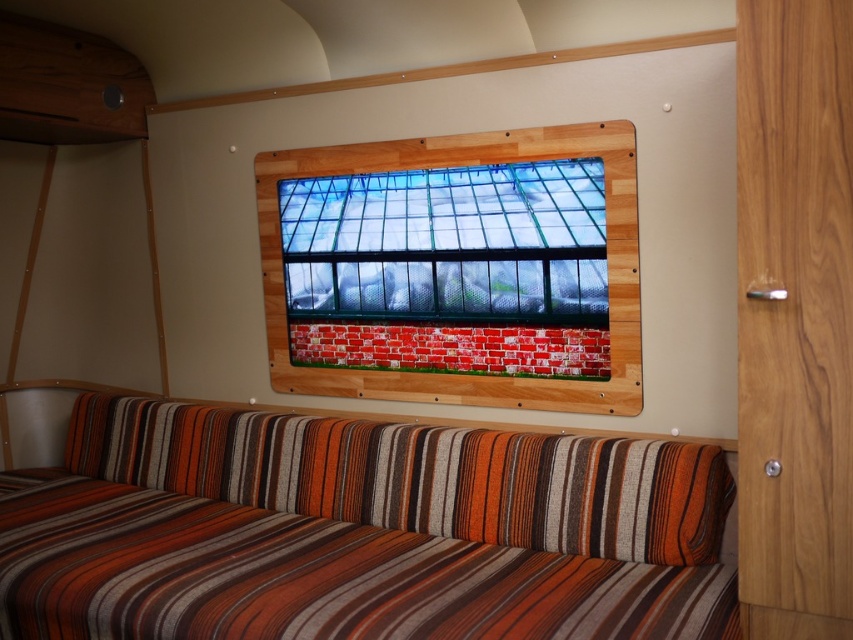
Is striped fabric couch at lower center thinner than transparent glass window at upper center?

Incorrect, striped fabric couch at lower center's width is not less than transparent glass window at upper center's.

Based on the photo, who is positioned more to the left, striped fabric couch at lower center or transparent glass window at upper center?

striped fabric couch at lower center

Between point (567, 438) and point (575, 157), which one is positioned in front?

Positioned in front is point (567, 438).

At what (x,y) coordinates should I click in order to perform the action: click on striped fabric couch at lower center. Please return your answer as a coordinate pair (x, y). Looking at the image, I should click on (358, 531).

Is wooden frame at center wider than transparent glass window at upper center?

Correct, the width of wooden frame at center exceeds that of transparent glass window at upper center.

Who is lower down, wooden frame at center or transparent glass window at upper center?

wooden frame at center is below.

Which is in front, point (592, 356) or point (432, 182)?

Point (592, 356) is more forward.

Locate an element on the screen. This screenshot has width=853, height=640. wooden frame at center is located at coordinates (456, 268).

Between striped fabric couch at lower center and wooden frame at center, which one appears on the right side from the viewer's perspective?

Positioned to the right is wooden frame at center.

Based on the photo, between striped fabric couch at lower center and wooden frame at center, which one has more height?

A: Standing taller between the two is wooden frame at center.

Who is more distant from viewer, [666,611] or [453,188]?

Point [453,188]

Where is `striped fabric couch at lower center`? The height and width of the screenshot is (640, 853). striped fabric couch at lower center is located at coordinates (358, 531).